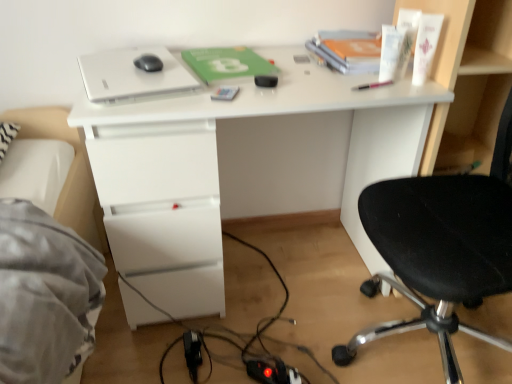
In order to click on free spot to the right of green matte paperback book at center in this screenshot , I will do `click(300, 68)`.